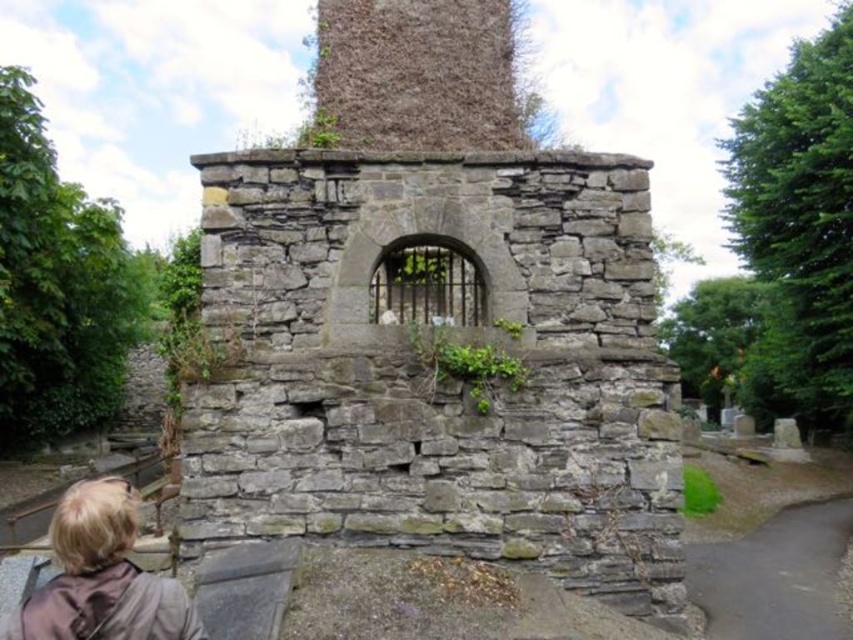
You are standing in front of the gray stone ruins at center and the blonde hair at lower left. Which object is taller?

The gray stone ruins at center is taller than blonde hair at lower left.

You are standing in front of the gray stone ruins at center. If you walk straight ahead, will you eventually reach the point marked by the coordinates point (434, 326)?

The gray stone ruins at center is represented by point (434, 326), so yes, walking straight ahead will lead you to that point.